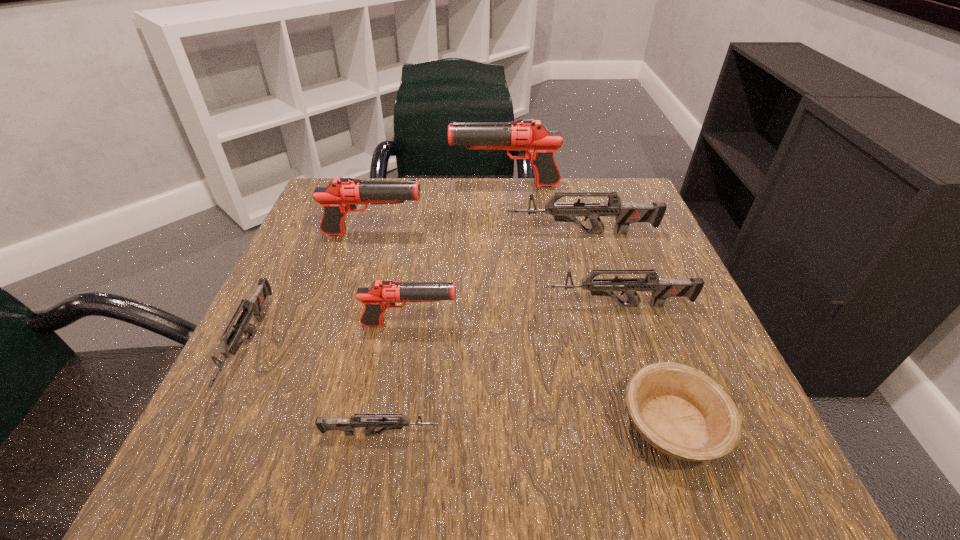
Identify the location of vacant space that satisfies the following two spatial constraints: 1. aimed along the barrel of the bowl; 2. on the left side of the fifth tallest gun. The image size is (960, 540). (657, 425).

Find the location of a particular element. Image resolution: width=960 pixels, height=540 pixels. vacant space that satisfies the following two spatial constraints: 1. on the front side of the beige bowl; 2. aimed along the barrel of the second grey gun from left to right is located at coordinates (676, 434).

Identify the location of vacant space that satisfies the following two spatial constraints: 1. at the aiming end of the second biggest black gun; 2. aimed along the barrel of the leftmost object. This screenshot has width=960, height=540. (x=340, y=343).